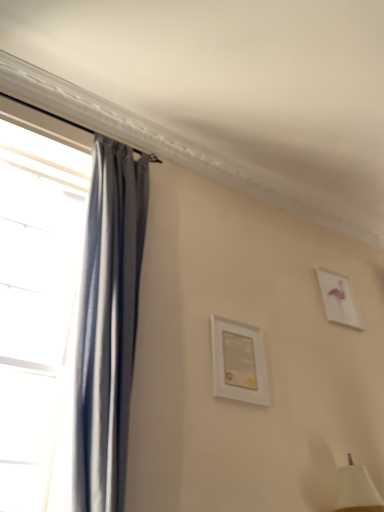
Image resolution: width=384 pixels, height=512 pixels. In order to click on white matte picture frame at center, marked as the first picture frame in a front-to-back arrangement in this screenshot , I will do `click(238, 362)`.

I want to click on white matte picture frame at center, marked as the first picture frame in a front-to-back arrangement, so click(x=238, y=362).

Could you tell me if white matte picture frame at center, the 2th picture frame when ordered from right to left, is turned towards white glossy picture frame at upper right, marked as the first picture frame in a right-to-left arrangement?

No, white matte picture frame at center, the 2th picture frame when ordered from right to left, is not facing towards white glossy picture frame at upper right, marked as the first picture frame in a right-to-left arrangement.

Is white matte picture frame at center, the first picture frame viewed from the left, smaller than white glossy picture frame at upper right, marked as the first picture frame in a right-to-left arrangement?

Yes.

Is white matte picture frame at center, the first picture frame viewed from the left, in contact with white glossy picture frame at upper right, marked as the first picture frame in a right-to-left arrangement?

No, white matte picture frame at center, the first picture frame viewed from the left, is not next to white glossy picture frame at upper right, marked as the first picture frame in a right-to-left arrangement.

Identify the location of picture frame above the white matte picture frame at center, marked as the first picture frame in a front-to-back arrangement (from a real-world perspective). (338, 298).

From the image's perspective, does white matte picture frame at center, which is the 2th picture frame in back-to-front order, appear lower than matte gray curtain at left?

Indeed, from the image's perspective, white matte picture frame at center, which is the 2th picture frame in back-to-front order, is shown beneath matte gray curtain at left.

Which is in front, white matte picture frame at center, which is the 2th picture frame in back-to-front order, or matte gray curtain at left?

matte gray curtain at left is in front.

In terms of height, does white matte picture frame at center, the first picture frame viewed from the left, look taller or shorter compared to matte gray curtain at left?

white matte picture frame at center, the first picture frame viewed from the left, is shorter than matte gray curtain at left.

Can you confirm if white matte picture frame at center, the first picture frame viewed from the left, is positioned to the right of matte gray curtain at left?

Indeed, white matte picture frame at center, the first picture frame viewed from the left, is positioned on the right side of matte gray curtain at left.

Is white glossy picture frame at upper right, the second picture frame in the front-to-back sequence, facing away from matte gray curtain at left?

No, white glossy picture frame at upper right, the second picture frame in the front-to-back sequence,'s orientation is not away from matte gray curtain at left.

Is white glossy picture frame at upper right, which ranks as the 1th picture frame in back-to-front order, in front of or behind matte gray curtain at left in the image?

Clearly, white glossy picture frame at upper right, which ranks as the 1th picture frame in back-to-front order, is behind matte gray curtain at left.

Which is behind, point (338, 289) or point (7, 209)?

Positioned behind is point (338, 289).

Is matte gray curtain at left inside or outside of white glossy picture frame at upper right, the second picture frame in the front-to-back sequence?

matte gray curtain at left is not enclosed by white glossy picture frame at upper right, the second picture frame in the front-to-back sequence.

In the scene shown: Could you measure the distance between matte gray curtain at left and white glossy picture frame at upper right, which ranks as the 2th picture frame in left-to-right order?

They are 1.69 meters apart.

Can you confirm if matte gray curtain at left is thinner than white glossy picture frame at upper right, marked as the first picture frame in a right-to-left arrangement?

No.

Is there a large distance between matte gray curtain at left and white glossy picture frame at upper right, marked as the first picture frame in a right-to-left arrangement?

Indeed, matte gray curtain at left is not near white glossy picture frame at upper right, marked as the first picture frame in a right-to-left arrangement.

From the image's perspective, is white glossy picture frame at upper right, which ranks as the 2th picture frame in left-to-right order, located above or below white matte picture frame at center, the first picture frame viewed from the left?

From the image's perspective, white glossy picture frame at upper right, which ranks as the 2th picture frame in left-to-right order, appears above white matte picture frame at center, the first picture frame viewed from the left.

From the picture: Does white glossy picture frame at upper right, which ranks as the 2th picture frame in left-to-right order, have a lesser width compared to white matte picture frame at center, the first picture frame viewed from the left?

Yes, white glossy picture frame at upper right, which ranks as the 2th picture frame in left-to-right order, is thinner than white matte picture frame at center, the first picture frame viewed from the left.

Is point (352, 324) closer or farther from the camera than point (247, 330)?

Point (352, 324) is farther from the camera than point (247, 330).

From the picture: Is white glossy picture frame at upper right, which ranks as the 1th picture frame in back-to-front order, completely or partially outside of white matte picture frame at center, which is the 2th picture frame in back-to-front order?

Absolutely, white glossy picture frame at upper right, which ranks as the 1th picture frame in back-to-front order, is external to white matte picture frame at center, which is the 2th picture frame in back-to-front order.

Visually, is matte gray curtain at left positioned to the left or to the right of white matte picture frame at center, the first picture frame viewed from the left?

From the image, it's evident that matte gray curtain at left is to the left of white matte picture frame at center, the first picture frame viewed from the left.

From the image's perspective, which is below, matte gray curtain at left or white matte picture frame at center, which is the 2th picture frame in back-to-front order?

white matte picture frame at center, which is the 2th picture frame in back-to-front order, is shown below in the image.

Is point (8, 189) farther from camera compared to point (215, 332)?

Yes, point (8, 189) is farther from viewer.

In the scene shown: Is matte gray curtain at left positioned beyond the bounds of white matte picture frame at center, marked as the first picture frame in a front-to-back arrangement?

Yes.

Locate an element on the screen. The height and width of the screenshot is (512, 384). picture frame below the white glossy picture frame at upper right, marked as the first picture frame in a right-to-left arrangement (from a real-world perspective) is located at coordinates (238, 362).

Locate an element on the screen. The height and width of the screenshot is (512, 384). window that appears in front of the white matte picture frame at center, which is the 2th picture frame in back-to-front order is located at coordinates (65, 313).

From the image, which object appears to be nearer to white glossy picture frame at upper right, which ranks as the 2th picture frame in left-to-right order, white matte picture frame at center, the first picture frame viewed from the left, or matte gray curtain at left?

white matte picture frame at center, the first picture frame viewed from the left, is positioned closer to the anchor white glossy picture frame at upper right, which ranks as the 2th picture frame in left-to-right order.

Which object lies further to the anchor point matte gray curtain at left, white glossy picture frame at upper right, the second picture frame in the front-to-back sequence, or white matte picture frame at center, marked as the first picture frame in a front-to-back arrangement?

white glossy picture frame at upper right, the second picture frame in the front-to-back sequence, is further to matte gray curtain at left.

Estimate the real-world distances between objects in this image. Which object is closer to white matte picture frame at center, the first picture frame viewed from the left, white glossy picture frame at upper right, the second picture frame in the front-to-back sequence, or matte gray curtain at left?

matte gray curtain at left is closer to white matte picture frame at center, the first picture frame viewed from the left.

Looking at the image, which one is located closer to white matte picture frame at center, which is the 2th picture frame in back-to-front order, matte gray curtain at left or white glossy picture frame at upper right, which ranks as the 2th picture frame in left-to-right order?

matte gray curtain at left is positioned closer to the anchor white matte picture frame at center, which is the 2th picture frame in back-to-front order.

Estimate the real-world distances between objects in this image. Which object is closer to white glossy picture frame at upper right, marked as the first picture frame in a right-to-left arrangement, matte gray curtain at left or white matte picture frame at center, which is the 2th picture frame in back-to-front order?

white matte picture frame at center, which is the 2th picture frame in back-to-front order, is positioned closer to the anchor white glossy picture frame at upper right, marked as the first picture frame in a right-to-left arrangement.

Considering their positions, is white matte picture frame at center, the 2th picture frame when ordered from right to left, positioned closer to matte gray curtain at left than white glossy picture frame at upper right, the second picture frame in the front-to-back sequence?

The object closer to matte gray curtain at left is white matte picture frame at center, the 2th picture frame when ordered from right to left.

I want to click on picture frame between matte gray curtain at left and white glossy picture frame at upper right, the second picture frame in the front-to-back sequence, along the z-axis, so click(x=238, y=362).